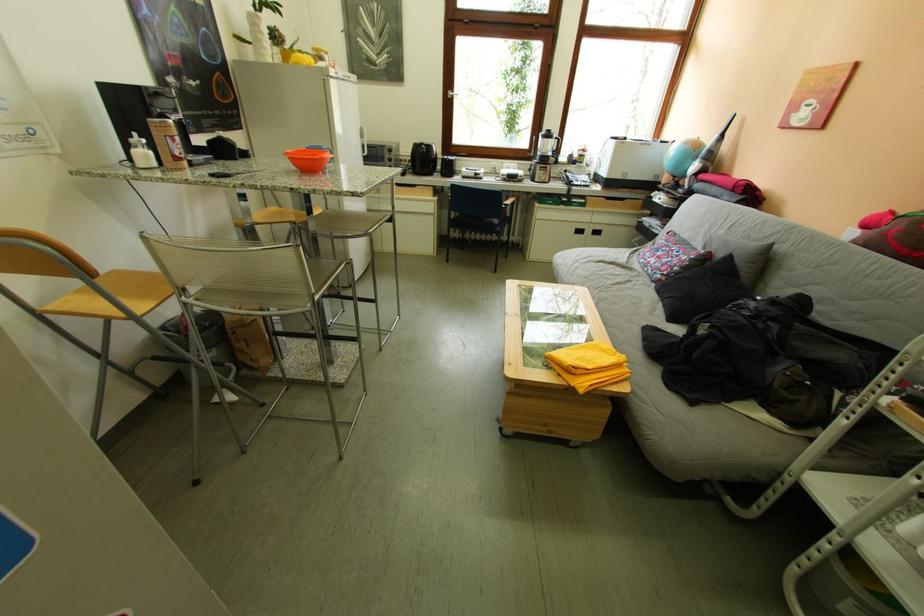
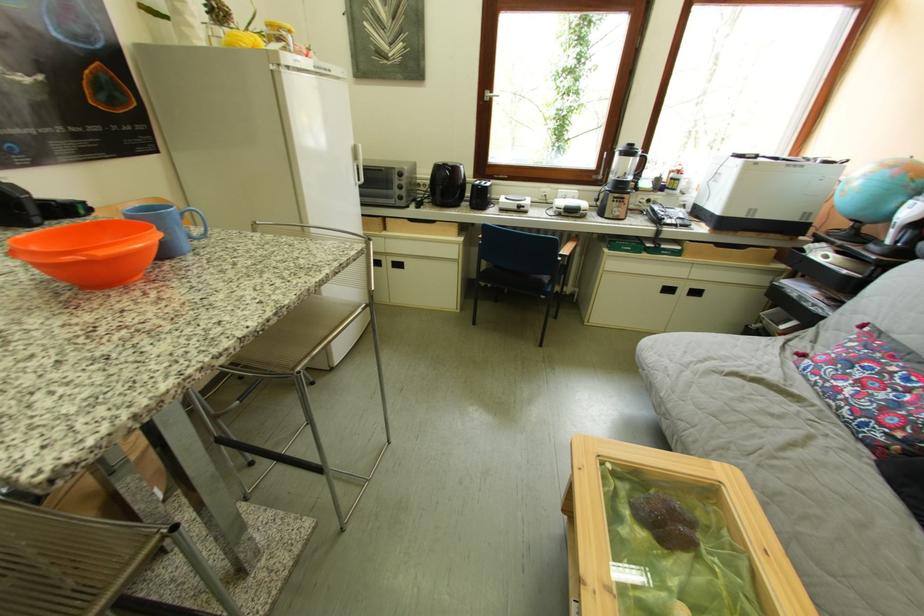
The point at (555,180) is marked in the first image. Where is the corresponding point in the second image?

(629, 217)